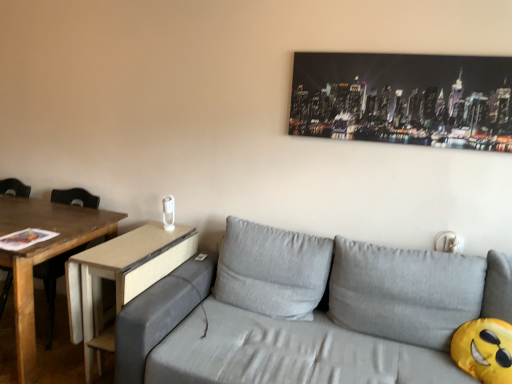
Question: Is gray fabric couch at center taller than light brown wood side table at center-left?

Choices:
 (A) yes
 (B) no

Answer: (A)

Question: Considering the relative positions of gray fabric couch at center and light brown wood side table at center-left in the image provided, is gray fabric couch at center to the right of light brown wood side table at center-left from the viewer's perspective?

Choices:
 (A) yes
 (B) no

Answer: (A)

Question: Could you tell me if gray fabric couch at center is turned towards light brown wood side table at center-left?

Choices:
 (A) no
 (B) yes

Answer: (A)

Question: Would you say gray fabric couch at center is outside light brown wood side table at center-left?

Choices:
 (A) yes
 (B) no

Answer: (A)

Question: From the image's perspective, is gray fabric couch at center under light brown wood side table at center-left?

Choices:
 (A) no
 (B) yes

Answer: (B)

Question: Is point (3, 269) closer or farther from the camera than point (100, 301)?

Choices:
 (A) closer
 (B) farther

Answer: (B)

Question: From a real-world perspective, is wooden chair at left physically located above or below light brown wood side table at center-left?

Choices:
 (A) above
 (B) below

Answer: (A)

Question: Is wooden chair at left situated inside light brown wood side table at center-left or outside?

Choices:
 (A) outside
 (B) inside

Answer: (A)

Question: Looking at the image, does wooden chair at left seem bigger or smaller compared to light brown wood side table at center-left?

Choices:
 (A) big
 (B) small

Answer: (A)

Question: Which is correct: metallic cityscape print at upper right is inside gray fabric couch at center, or outside of it?

Choices:
 (A) inside
 (B) outside

Answer: (B)

Question: Would you say metallic cityscape print at upper right is to the left or to the right of gray fabric couch at center in the picture?

Choices:
 (A) left
 (B) right

Answer: (B)

Question: From a real-world perspective, relative to gray fabric couch at center, is metallic cityscape print at upper right vertically above or below?

Choices:
 (A) above
 (B) below

Answer: (A)

Question: From the image's perspective, is metallic cityscape print at upper right positioned above or below gray fabric couch at center?

Choices:
 (A) above
 (B) below

Answer: (A)

Question: Is point (55, 271) closer or farther from the camera than point (337, 261)?

Choices:
 (A) closer
 (B) farther

Answer: (B)

Question: From a real-world perspective, is wooden chair at left positioned above or below gray fabric couch at center?

Choices:
 (A) below
 (B) above

Answer: (A)